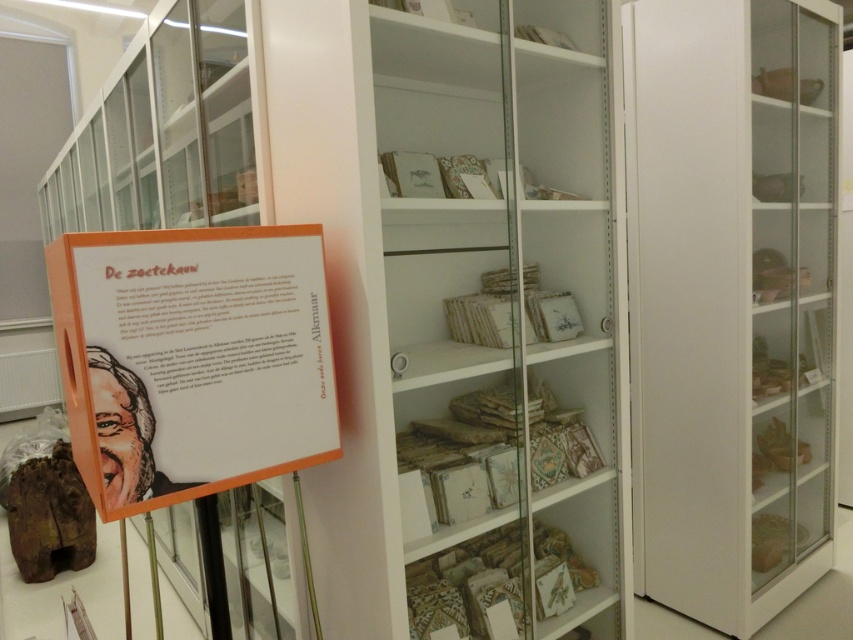
At what (x,y) coordinates should I click in order to perform the action: click on orange paper poster at center. Please return your answer as a coordinate pair (x, y). Looking at the image, I should click on (192, 358).

Between orange paper poster at center and white glossy bookshelf at center, which one appears on the right side from the viewer's perspective?

Positioned to the right is orange paper poster at center.

Which is in front, point (322, 355) or point (111, 221)?

Point (322, 355) is more forward.

At what (x,y) coordinates should I click in order to perform the action: click on orange paper poster at center. Please return your answer as a coordinate pair (x, y). This screenshot has width=853, height=640. Looking at the image, I should click on pyautogui.click(x=192, y=358).

Can you confirm if matte white bookshelf at center is positioned above orange paper poster at center?

Incorrect, matte white bookshelf at center is not positioned above orange paper poster at center.

Can you confirm if matte white bookshelf at center is wider than orange paper poster at center?

Yes.

Image resolution: width=853 pixels, height=640 pixels. Describe the element at coordinates (461, 308) in the screenshot. I see `matte white bookshelf at center` at that location.

Find the location of a particular element. matte white bookshelf at center is located at coordinates (461, 308).

Is white glossy cabinet at right smaller than white glossy bookshelf at center?

Yes, white glossy cabinet at right is smaller than white glossy bookshelf at center.

Does white glossy cabinet at right appear over white glossy bookshelf at center?

No.

Is point (643, 593) behind point (178, 579)?

No, it is in front of (178, 579).

The width and height of the screenshot is (853, 640). Identify the location of white glossy cabinet at right. (730, 300).